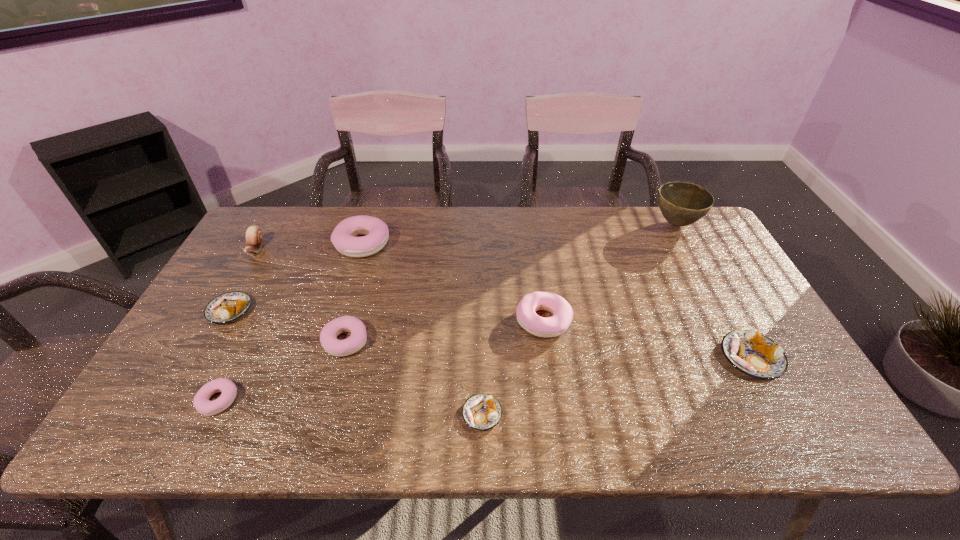
Locate an element on the screen. The width and height of the screenshot is (960, 540). free spot between the farthest pastry and the third biggest pink pastry is located at coordinates (354, 293).

The width and height of the screenshot is (960, 540). In order to click on free point between the bowl and the second smallest brown pastry in this screenshot , I will do `click(453, 267)`.

The height and width of the screenshot is (540, 960). What are the coordinates of `vacant space that is in between the second smallest pink pastry and the escargot` in the screenshot? It's located at (300, 295).

Locate an element on the screen. This screenshot has height=540, width=960. vacant space in between the nearest pink pastry and the escargot is located at coordinates (237, 325).

Image resolution: width=960 pixels, height=540 pixels. Identify the location of vacant region between the second brown pastry from right to left and the smallest pink pastry. [350, 407].

Image resolution: width=960 pixels, height=540 pixels. I want to click on empty space between the seventh object from left to right and the bowl, so click(x=610, y=272).

Locate an element on the screen. The image size is (960, 540). vacant area between the biggest pink pastry and the second brown pastry from right to left is located at coordinates (422, 329).

Locate an element on the screen. Image resolution: width=960 pixels, height=540 pixels. vacant space that's between the tallest object and the third biggest pink pastry is located at coordinates (511, 282).

Where is `vacant point located between the second nearest brown pastry and the third biggest pink pastry`? The height and width of the screenshot is (540, 960). vacant point located between the second nearest brown pastry and the third biggest pink pastry is located at coordinates (548, 349).

This screenshot has height=540, width=960. Find the location of `the sixth closest object to the biggest brown pastry`. the sixth closest object to the biggest brown pastry is located at coordinates (202, 404).